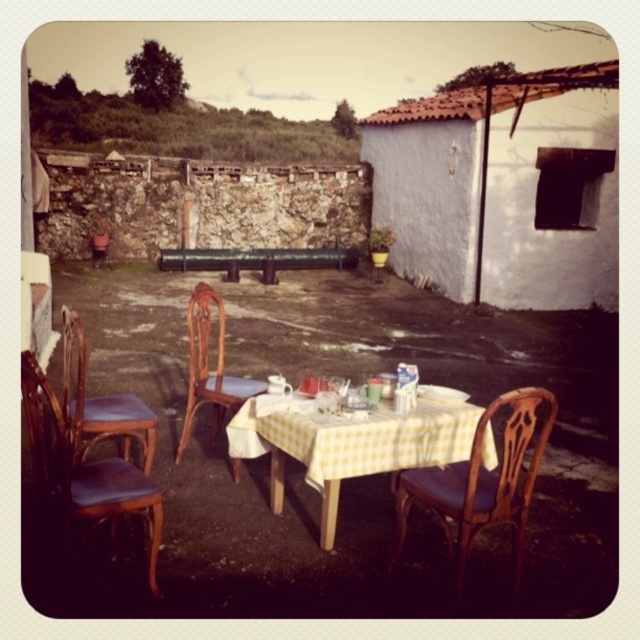
Question: Which point is farther to the camera?

Choices:
 (A) wooden chair with cushion at center
 (B) brown leather chair at left
 (C) white stucco hut at upper right
 (D) brown wooden chair at center

Answer: (C)

Question: Where is brown leather chair at lower left located in relation to brown leather chair at left in the image?

Choices:
 (A) below
 (B) above

Answer: (A)

Question: Based on their relative distances, which object is farther from the yellow checkered tablecloth at center?

Choices:
 (A) brown leather chair at lower left
 (B) brown leather chair at left
 (C) white stucco hut at upper right

Answer: (C)

Question: Is wooden chair with cushion at center to the right of brown wooden chair at center from the viewer's perspective?

Choices:
 (A) no
 (B) yes

Answer: (B)

Question: Does yellow checkered tablecloth at center come behind brown leather chair at left?

Choices:
 (A) yes
 (B) no

Answer: (B)

Question: Which point is closer to the camera taking this photo?

Choices:
 (A) (266, 438)
 (B) (204, 285)

Answer: (A)